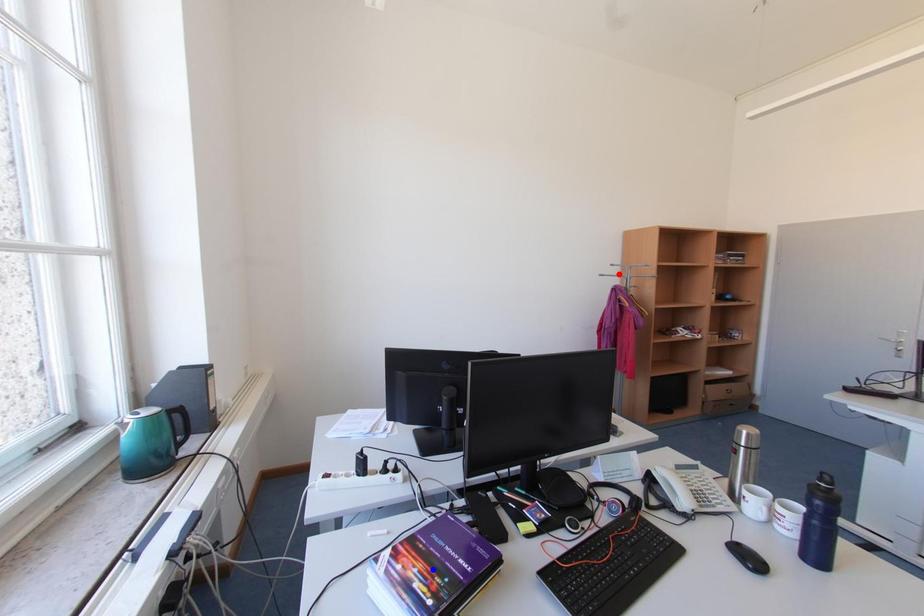
Question: Which of the two points in the image is closer to the camera?

Choices:
 (A) Blue point is closer.
 (B) Red point is closer.

Answer: (A)